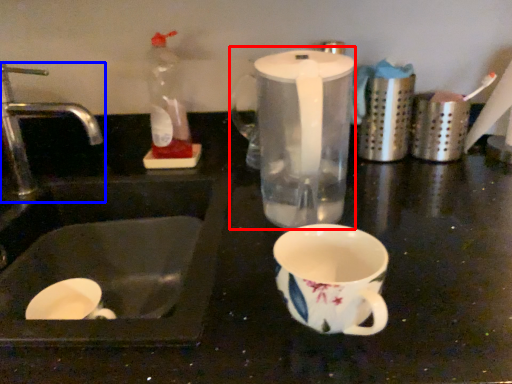
Question: Which object is further to the camera taking this photo, blender (highlighted by a red box) or tap (highlighted by a blue box)?

Choices:
 (A) blender
 (B) tap

Answer: (B)